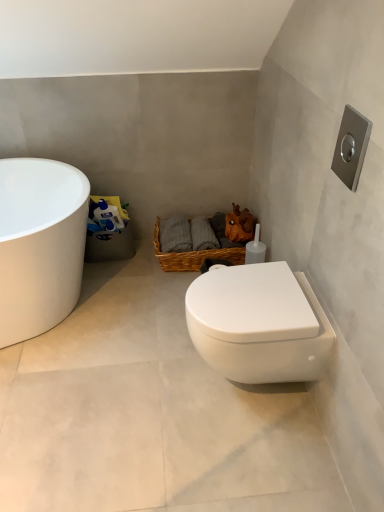
The image size is (384, 512). Identify the location of spots to the right of white glossy bathtub at left. (150, 306).